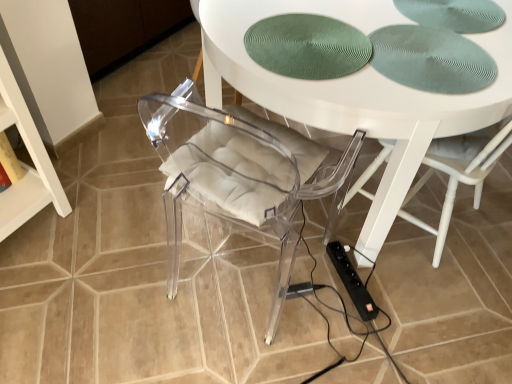
Locate an element on the screen. The height and width of the screenshot is (384, 512). vacant area that is in front of black plastic extension cord at lower right is located at coordinates (373, 324).